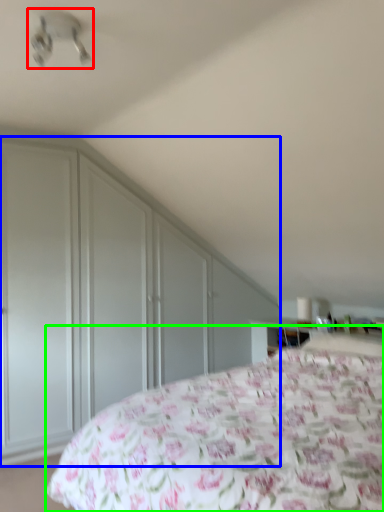
Question: Considering the real-world distances, which object is closest to fan (highlighted by a red box)? dresser (highlighted by a blue box) or bed (highlighted by a green box).

Choices:
 (A) dresser
 (B) bed

Answer: (A)